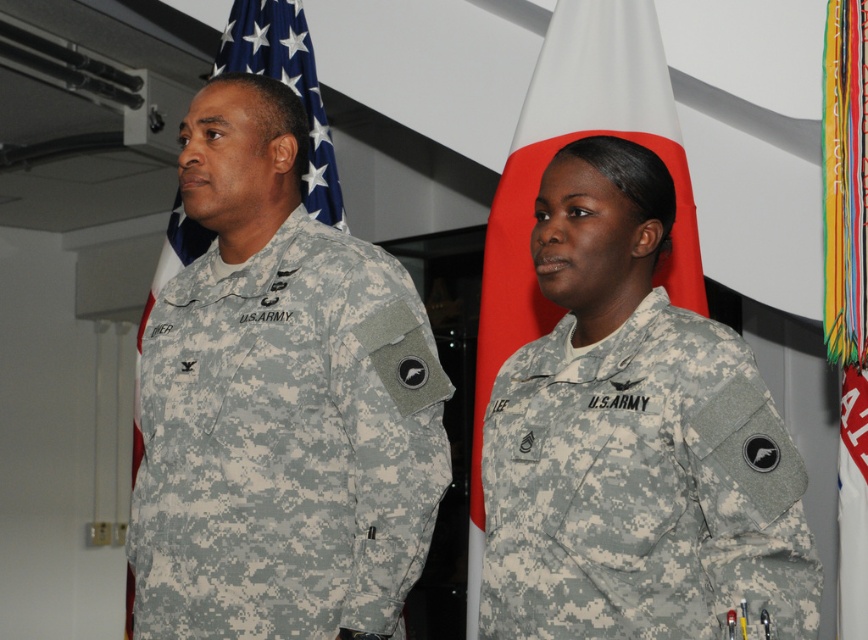
Question: Which of the following is the farthest from the observer?

Choices:
 (A) (228, 301)
 (B) (646, 483)

Answer: (A)

Question: Which of the following is the closest to the observer?

Choices:
 (A) (334, 248)
 (B) (514, 385)

Answer: (B)

Question: Which point appears closest to the camera in this image?

Choices:
 (A) (717, 368)
 (B) (248, 353)

Answer: (A)

Question: Can you confirm if camouflage fabric uniform at left is positioned to the right of camouflage fabric uniform at center?

Choices:
 (A) no
 (B) yes

Answer: (A)

Question: Does camouflage fabric uniform at left have a lesser width compared to camouflage fabric uniform at center?

Choices:
 (A) no
 (B) yes

Answer: (A)

Question: Can you confirm if camouflage fabric uniform at left is positioned above camouflage fabric uniform at center?

Choices:
 (A) yes
 (B) no

Answer: (A)